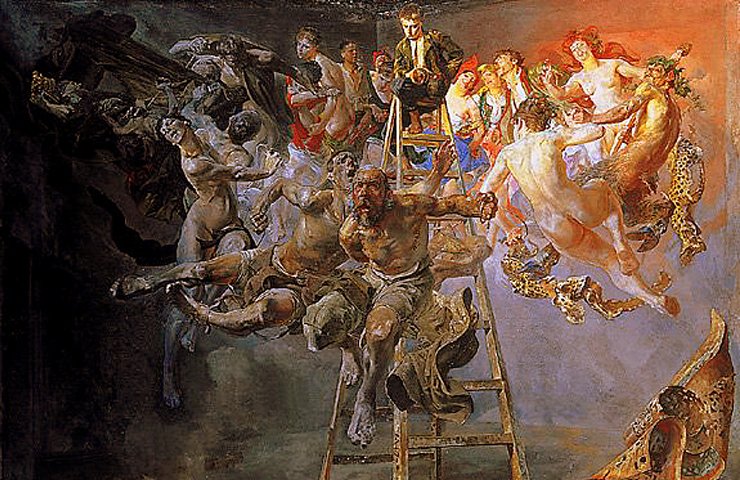
Where is `gray paint`? gray paint is located at coordinates (595, 361).